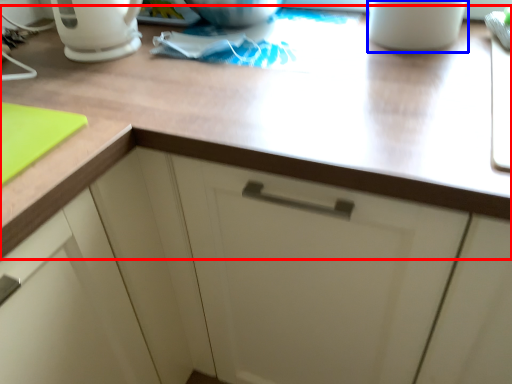
Question: Which of the following is the farthest to the observer, countertop (highlighted by a red box) or mug (highlighted by a blue box)?

Choices:
 (A) countertop
 (B) mug

Answer: (B)